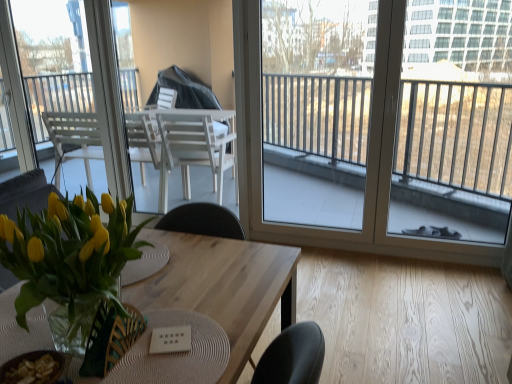
Question: Can you confirm if wooden table at center is bigger than transparent glass window at center, which ranks as the first window in front-to-back order?

Choices:
 (A) no
 (B) yes

Answer: (B)

Question: Is wooden table at center further to camera compared to transparent glass window at center, marked as the first window in a right-to-left arrangement?

Choices:
 (A) no
 (B) yes

Answer: (A)

Question: Is wooden table at center positioned before transparent glass window at center, which is counted as the 2th window, starting from the back?

Choices:
 (A) yes
 (B) no

Answer: (A)

Question: Does wooden table at center contain transparent glass window at center, marked as the first window in a right-to-left arrangement?

Choices:
 (A) yes
 (B) no

Answer: (B)

Question: Is wooden table at center to the left of transparent glass window at center, which is counted as the 2th window, starting from the back, from the viewer's perspective?

Choices:
 (A) yes
 (B) no

Answer: (A)

Question: Is wooden table at center taller than transparent glass window at center, marked as the first window in a right-to-left arrangement?

Choices:
 (A) no
 (B) yes

Answer: (A)

Question: From a real-world perspective, is translucent glass vase at lower left physically below transparent glass window at center, marked as the first window in a right-to-left arrangement?

Choices:
 (A) yes
 (B) no

Answer: (B)

Question: Is translucent glass vase at lower left thinner than transparent glass window at center, which ranks as the first window in front-to-back order?

Choices:
 (A) no
 (B) yes

Answer: (A)

Question: From a real-world perspective, is translucent glass vase at lower left physically above transparent glass window at center, which ranks as the first window in front-to-back order?

Choices:
 (A) yes
 (B) no

Answer: (A)

Question: Can you confirm if translucent glass vase at lower left is shorter than transparent glass window at center, the 2th window when ordered from left to right?

Choices:
 (A) no
 (B) yes

Answer: (B)

Question: Is translucent glass vase at lower left completely or partially outside of transparent glass window at center, which is counted as the 2th window, starting from the back?

Choices:
 (A) no
 (B) yes

Answer: (B)

Question: Does translucent glass vase at lower left appear on the left side of transparent glass window at center, which ranks as the first window in front-to-back order?

Choices:
 (A) no
 (B) yes

Answer: (B)

Question: From a real-world perspective, is green woven armchair at center positioned over transparent glass window at center, which ranks as the first window in front-to-back order, based on gravity?

Choices:
 (A) no
 (B) yes

Answer: (A)